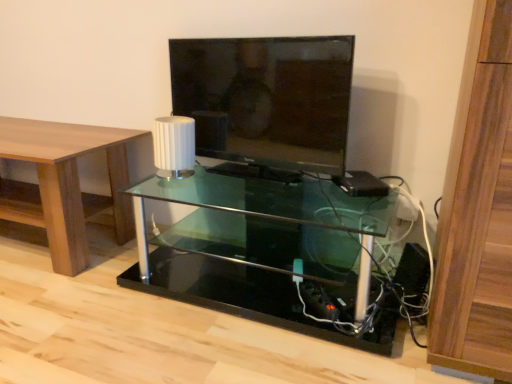
Question: Is transparent glass shelf at center located outside white matte lamp at center?

Choices:
 (A) yes
 (B) no

Answer: (A)

Question: From the image's perspective, is transparent glass shelf at center under white matte lamp at center?

Choices:
 (A) yes
 (B) no

Answer: (A)

Question: From a real-world perspective, does transparent glass shelf at center sit lower than white matte lamp at center?

Choices:
 (A) no
 (B) yes

Answer: (B)

Question: Is the depth of transparent glass shelf at center greater than that of white matte lamp at center?

Choices:
 (A) no
 (B) yes

Answer: (A)

Question: Does transparent glass shelf at center have a smaller size compared to white matte lamp at center?

Choices:
 (A) yes
 (B) no

Answer: (B)

Question: Is white matte lamp at center in front of or behind black plastic speaker at lower right in the image?

Choices:
 (A) behind
 (B) front

Answer: (A)

Question: From a real-world perspective, is white matte lamp at center physically located above or below black plastic speaker at lower right?

Choices:
 (A) above
 (B) below

Answer: (A)

Question: Is point (167, 172) positioned closer to the camera than point (419, 264)?

Choices:
 (A) farther
 (B) closer

Answer: (A)

Question: Looking at their shapes, would you say white matte lamp at center is wider or thinner than black plastic speaker at lower right?

Choices:
 (A) wide
 (B) thin

Answer: (A)

Question: Considering their positions, is matte black tv at center located in front of or behind transparent glass shelf at center?

Choices:
 (A) front
 (B) behind

Answer: (B)

Question: Is matte black tv at center bigger or smaller than transparent glass shelf at center?

Choices:
 (A) small
 (B) big

Answer: (A)

Question: From a real-world perspective, relative to transparent glass shelf at center, is matte black tv at center vertically above or below?

Choices:
 (A) above
 (B) below

Answer: (A)

Question: Does point (207, 69) appear closer or farther from the camera than point (229, 218)?

Choices:
 (A) farther
 (B) closer

Answer: (B)

Question: Based on their sizes in the image, would you say black plastic speaker at lower right is bigger or smaller than wooden table at left?

Choices:
 (A) big
 (B) small

Answer: (B)

Question: Is point (402, 253) positioned closer to the camera than point (40, 173)?

Choices:
 (A) closer
 (B) farther

Answer: (A)